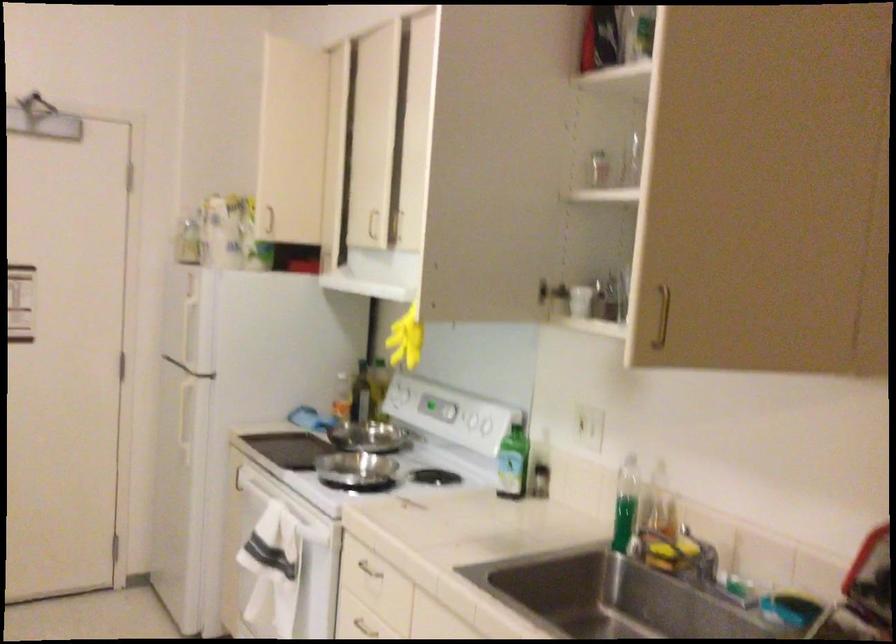
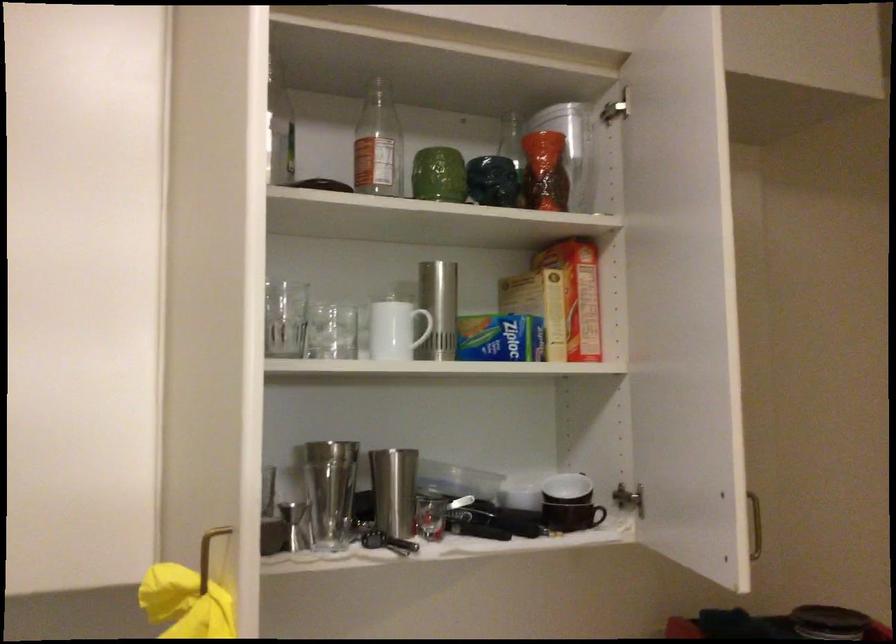
The point at [442,270] is marked in the first image. Where is the corresponding point in the second image?

(209, 554)